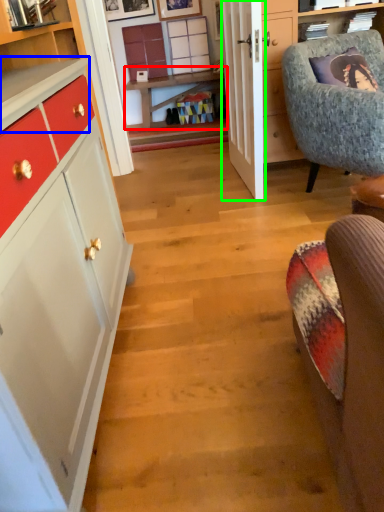
Question: Which object is positioned farthest from table (highlighted by a red box)? Select from counter top (highlighted by a blue box) and door (highlighted by a green box).

Choices:
 (A) counter top
 (B) door

Answer: (A)